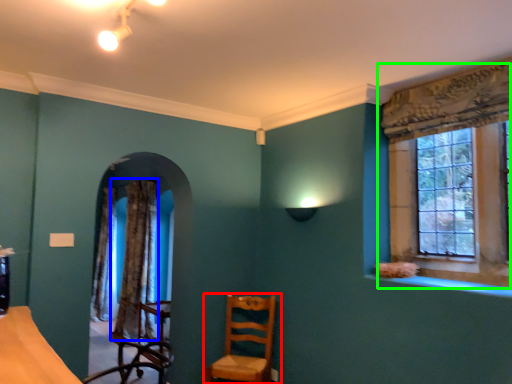
Question: Which is nearer to the chair (highlighted by a red box)? curtain (highlighted by a blue box) or window (highlighted by a green box).

Choices:
 (A) curtain
 (B) window

Answer: (A)